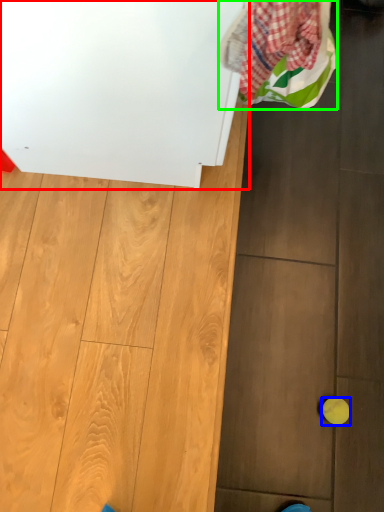
Question: Which is nearer to the appliance (highlighted by a red box)? ball (highlighted by a blue box) or laundry (highlighted by a green box).

Choices:
 (A) ball
 (B) laundry

Answer: (B)